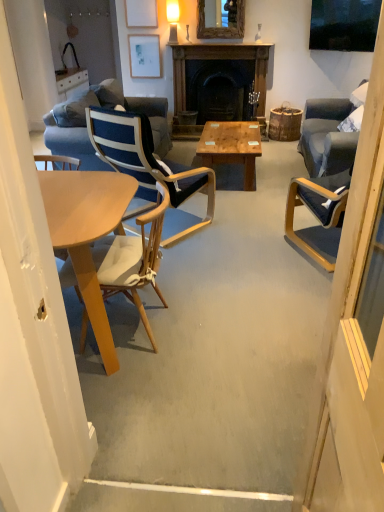
Question: Which direction should I rotate to look at matte white picture frame at upper center, arranged as the 2th picture frame when ordered from the bottom, — up or down?

Choices:
 (A) up
 (B) down

Answer: (A)

Question: Is wooden frame mirror at upper center taller than blue fabric chair at center, the first chair viewed from the back?

Choices:
 (A) no
 (B) yes

Answer: (A)

Question: Is wooden frame mirror at upper center thinner than blue fabric chair at center, the first chair viewed from the back?

Choices:
 (A) no
 (B) yes

Answer: (B)

Question: Does wooden frame mirror at upper center have a greater width compared to blue fabric chair at center, the first chair viewed from the back?

Choices:
 (A) yes
 (B) no

Answer: (B)

Question: Can you confirm if wooden frame mirror at upper center is shorter than blue fabric chair at center, the first chair viewed from the back?

Choices:
 (A) yes
 (B) no

Answer: (A)

Question: From a real-world perspective, does wooden frame mirror at upper center sit lower than blue fabric chair at center, placed as the 2th chair when sorted from front to back?

Choices:
 (A) yes
 (B) no

Answer: (B)

Question: From the image's perspective, does wooden frame mirror at upper center appear lower than blue fabric chair at center, the first chair viewed from the back?

Choices:
 (A) no
 (B) yes

Answer: (A)

Question: Does matte white picture frame at upper center, positioned as the 2th picture frame in back-to-front order, come behind matte blue chair at right?

Choices:
 (A) yes
 (B) no

Answer: (A)

Question: From a real-world perspective, is matte white picture frame at upper center, placed as the first picture frame when sorted from front to back, physically below matte blue chair at right?

Choices:
 (A) no
 (B) yes

Answer: (A)

Question: Is matte white picture frame at upper center, placed as the 1th picture frame when sorted from top to bottom, positioned in front of matte blue chair at right?

Choices:
 (A) no
 (B) yes

Answer: (A)

Question: From a real-world perspective, is matte white picture frame at upper center, arranged as the 2th picture frame when ordered from the bottom, on matte blue chair at right?

Choices:
 (A) yes
 (B) no

Answer: (A)

Question: Is matte white picture frame at upper center, positioned as the 2th picture frame in back-to-front order, positioned far away from matte blue chair at right?

Choices:
 (A) yes
 (B) no

Answer: (A)

Question: Considering the relative positions of matte white picture frame at upper center, placed as the first picture frame when sorted from front to back, and matte blue chair at right in the image provided, is matte white picture frame at upper center, placed as the first picture frame when sorted from front to back, to the left of matte blue chair at right from the viewer's perspective?

Choices:
 (A) yes
 (B) no

Answer: (A)

Question: Considering the relative positions of woodenmaterial/texturecoffee table at center and wooden fireplace at center in the image provided, is woodenmaterial/texturecoffee table at center behind wooden fireplace at center?

Choices:
 (A) yes
 (B) no

Answer: (B)